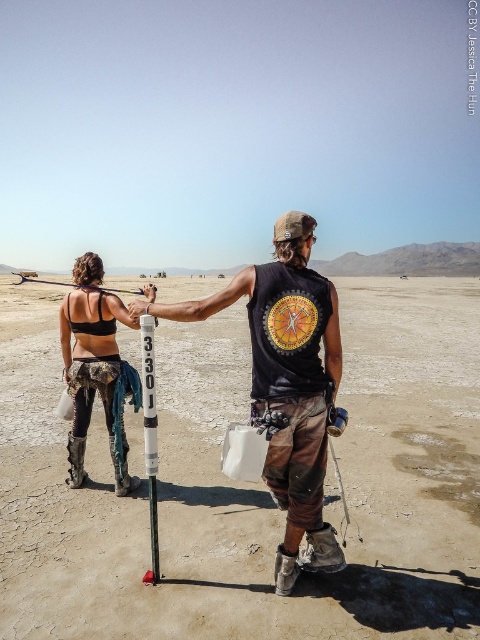
You are a surveyor in the desert and need to mark the exact center of the dull brown dirt at center. According to the coordinates provided, where should you place your marker?

The exact center of the dull brown dirt at center is located at the coordinates point [250,484], so place the marker there.

Two people are standing in a desert. The person on the right is holding a white cylindrical object labeled 3301. You are standing at point (291, 256). Which direction should you move to get closer to the person holding the object?

Since the two people are 2.93 meters apart, you should move toward the person on the right who is holding the white cylindrical object labeled 3301 to get closer to them.